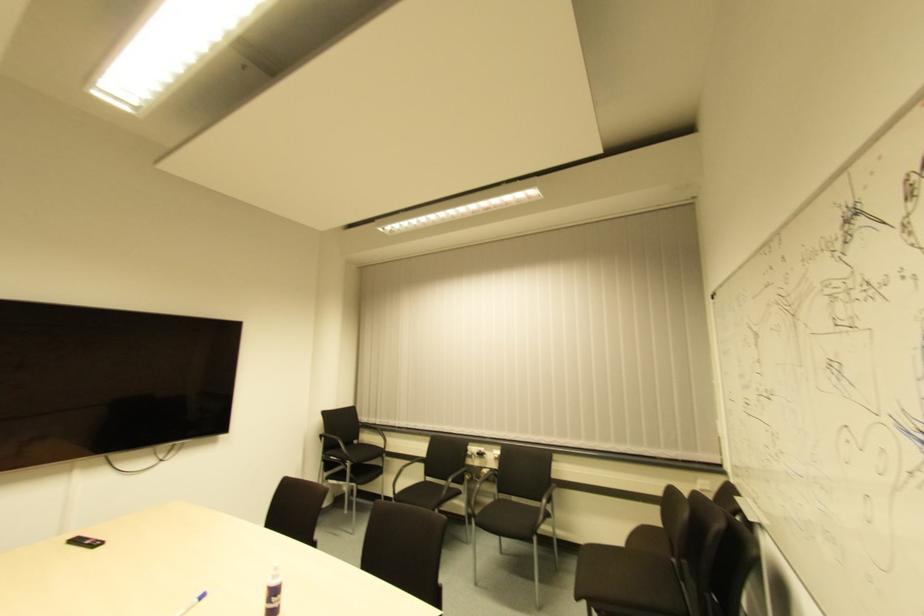
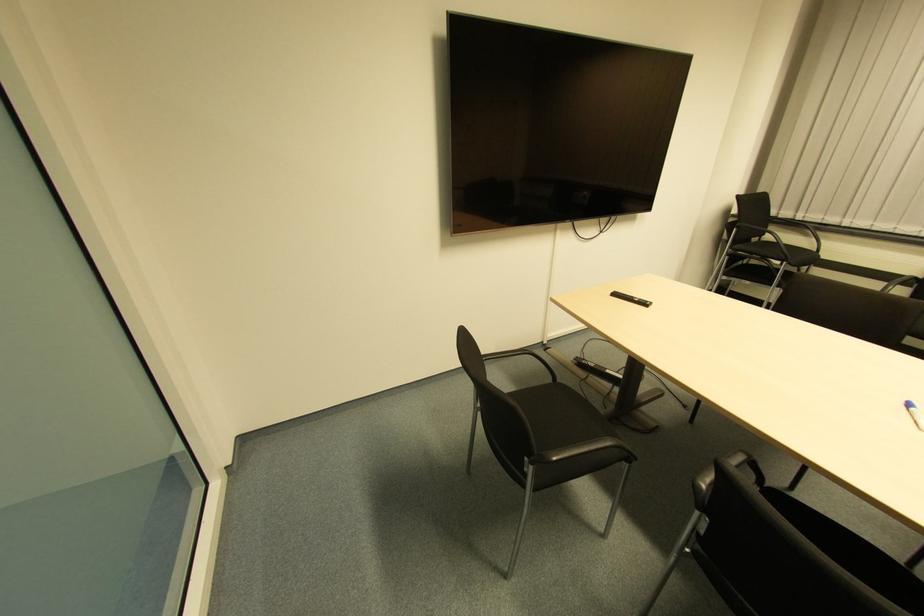
Locate, in the second image, the point that corresponds to the point at 92,546 in the first image.

(641, 306)